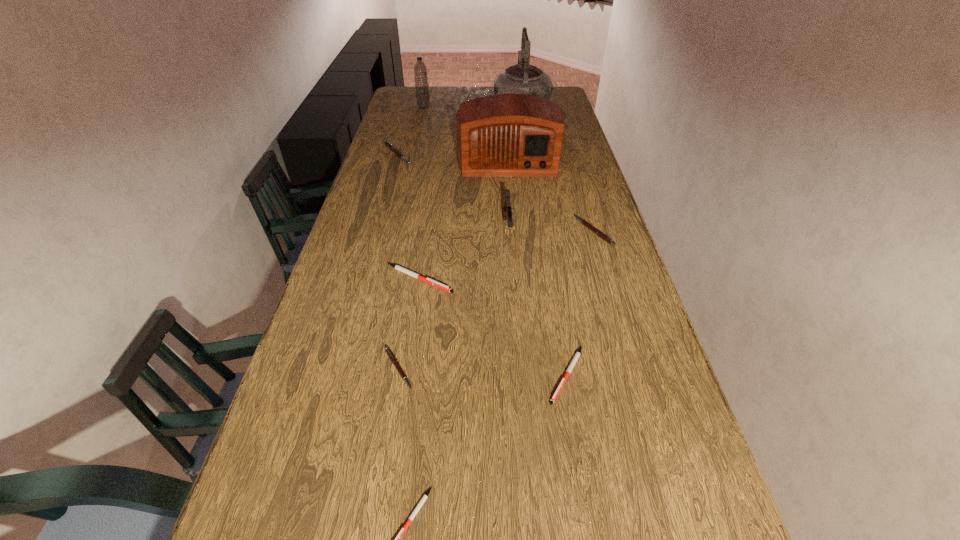
At what (x,y) coordinates should I click in order to perform the action: click on kettle. Please return your answer as a coordinate pair (x, y). The image size is (960, 540). Looking at the image, I should click on (522, 78).

Locate an element on the screen. Image resolution: width=960 pixels, height=540 pixels. radio receiver is located at coordinates (509, 134).

This screenshot has width=960, height=540. In order to click on blue water bottle in this screenshot , I will do `click(420, 70)`.

Where is `gray gun`? This screenshot has width=960, height=540. gray gun is located at coordinates (507, 206).

The height and width of the screenshot is (540, 960). Identify the location of gun. (507, 206).

You are a GUI agent. You are given a task and a screenshot of the screen. Output one action in this format:
    pyautogui.click(x=<x>, y=<y>)
    Task: Click on the tallest pen
    The height and width of the screenshot is (540, 960).
    Given the screenshot: What is the action you would take?
    pyautogui.click(x=387, y=143)

Locate an element on the screen. Image resolution: width=960 pixels, height=540 pixels. the leftmost pen is located at coordinates (387, 143).

Where is `the rightmost pink pen`? The image size is (960, 540). the rightmost pink pen is located at coordinates (585, 223).

This screenshot has height=540, width=960. In order to click on the second farthest pink pen in this screenshot , I will do `click(585, 223)`.

This screenshot has width=960, height=540. What are the coordinates of `the farthest white pen` in the screenshot? It's located at (397, 267).